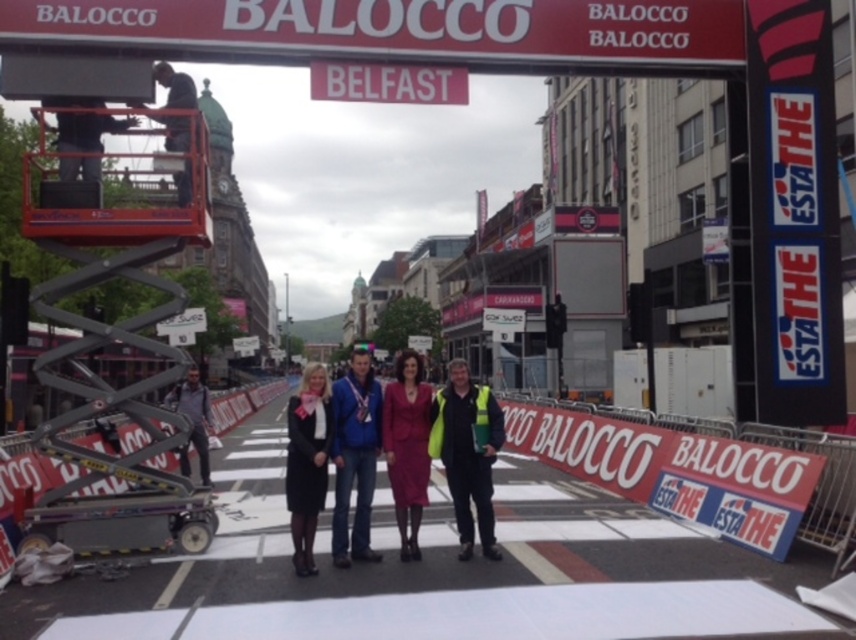
Question: Which of the following is the farthest from the observer?

Choices:
 (A) (396, 508)
 (B) (379, 448)
 (C) (465, 449)
 (D) (289, 442)

Answer: (B)

Question: Which point is closer to the camera taking this photo?

Choices:
 (A) (471, 525)
 (B) (360, 426)
 (C) (308, 483)
 (D) (424, 419)

Answer: (C)

Question: Can you confirm if matte pink dress at center is bigger than black fabric coat at center?

Choices:
 (A) yes
 (B) no

Answer: (B)

Question: In this image, where is neon yellow safety vest at center located relative to black fabric coat at center?

Choices:
 (A) below
 (B) above

Answer: (B)

Question: Is matte pink dress at center further to camera compared to black fabric coat at center?

Choices:
 (A) yes
 (B) no

Answer: (A)

Question: Which object is positioned farthest from the blue denim jacket at center?

Choices:
 (A) black fabric coat at center
 (B) yellow reflective safety vest at center
 (C) matte pink dress at center

Answer: (A)